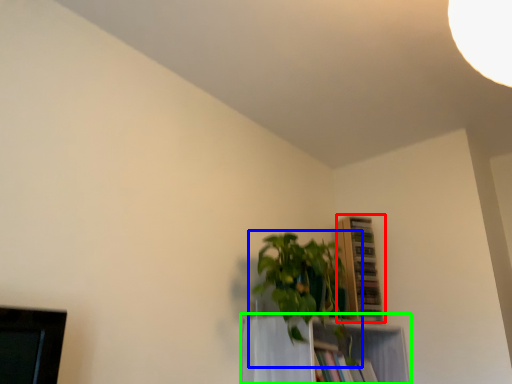
Question: Which object is the farthest from shelf (highlighted by a red box)? Choose among these: houseplant (highlighted by a blue box) or shelf (highlighted by a green box).

Choices:
 (A) houseplant
 (B) shelf

Answer: (A)